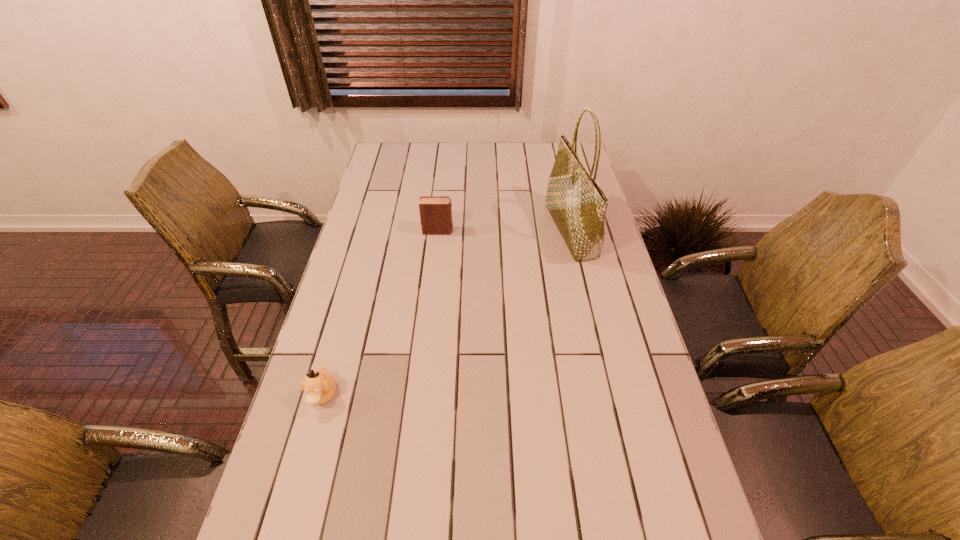
Locate an element on the screen. Image resolution: width=960 pixels, height=540 pixels. the tallest object is located at coordinates (577, 203).

Where is `shopping bag`? This screenshot has height=540, width=960. shopping bag is located at coordinates (577, 203).

The image size is (960, 540). What are the coordinates of `the second object from left to right` in the screenshot? It's located at (435, 212).

Find the location of `the second tallest object`. the second tallest object is located at coordinates (435, 212).

This screenshot has width=960, height=540. Identify the location of duckling. (319, 385).

Find the location of a particular element. the nearest object is located at coordinates (319, 385).

Find the location of a particular element. Image resolution: width=960 pixels, height=540 pixels. vacant region located on the left of the shopping bag is located at coordinates (481, 231).

I want to click on vacant position located 0.210m on the spine side of the second tallest object, so click(x=513, y=231).

You are a GUI agent. You are given a task and a screenshot of the screen. Output one action in this format:
    pyautogui.click(x=<x>, y=<y>)
    Task: Click on the free spot located 0.220m on the face of the duckling
    
    Given the screenshot: What is the action you would take?
    pyautogui.click(x=289, y=514)

I want to click on object situated at the left edge, so click(x=319, y=385).